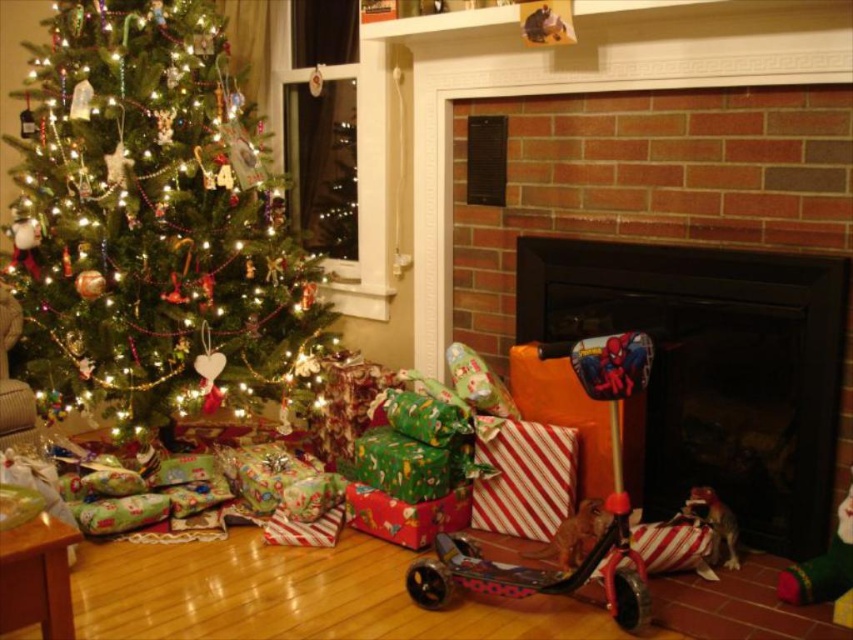
Question: Is shiny green tree at left closer to camera compared to black matte fireplace at center?

Choices:
 (A) no
 (B) yes

Answer: (A)

Question: Where is black matte fireplace at center located in relation to metallic pink scooter at lower center in the image?

Choices:
 (A) below
 (B) above

Answer: (B)

Question: Among these points, which one is farthest from the camera?

Choices:
 (A) (776, 410)
 (B) (631, 563)
 (C) (177, 332)

Answer: (C)

Question: Does black matte fireplace at center lie behind metallic pink scooter at lower center?

Choices:
 (A) no
 (B) yes

Answer: (B)

Question: Which object is farther from the camera taking this photo?

Choices:
 (A) shiny green tree at left
 (B) black matte fireplace at center
 (C) metallic pink scooter at lower center

Answer: (A)

Question: Which point is farther to the camera?

Choices:
 (A) (645, 353)
 (B) (131, 316)
 (C) (625, 244)

Answer: (B)